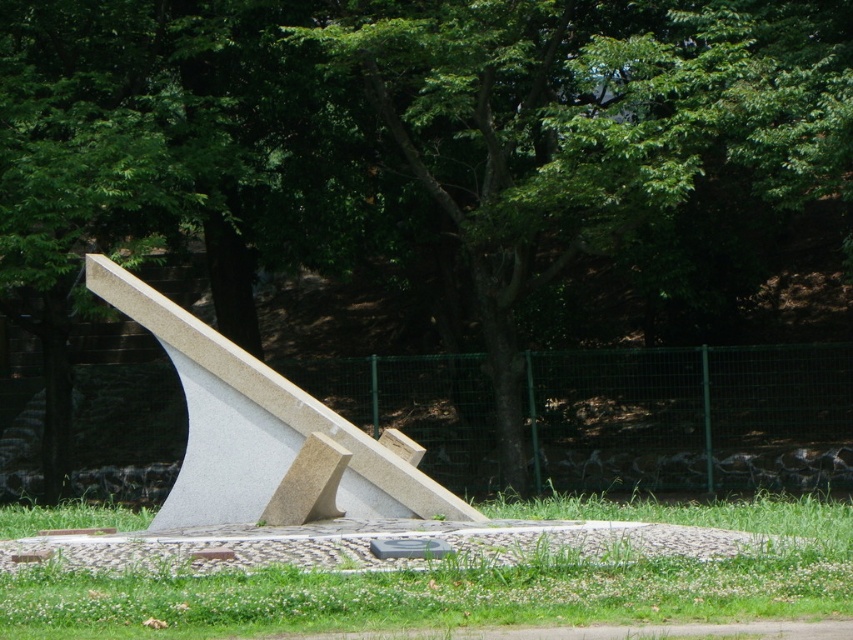
Question: Which object appears closest to the camera in this image?

Choices:
 (A) gray polished stone sundial at center
 (B) green grass at center

Answer: (B)

Question: Among these objects, which one is nearest to the camera?

Choices:
 (A) green grass at center
 (B) gray polished stone sundial at center

Answer: (A)

Question: In this image, where is green grass at center located relative to gray polished stone sundial at center?

Choices:
 (A) right
 (B) left

Answer: (A)

Question: Is green grass at center smaller than gray polished stone sundial at center?

Choices:
 (A) no
 (B) yes

Answer: (A)

Question: Which object is closer to the camera taking this photo?

Choices:
 (A) gray polished stone sundial at center
 (B) green grass at center

Answer: (B)

Question: Is green grass at center below gray polished stone sundial at center?

Choices:
 (A) no
 (B) yes

Answer: (B)